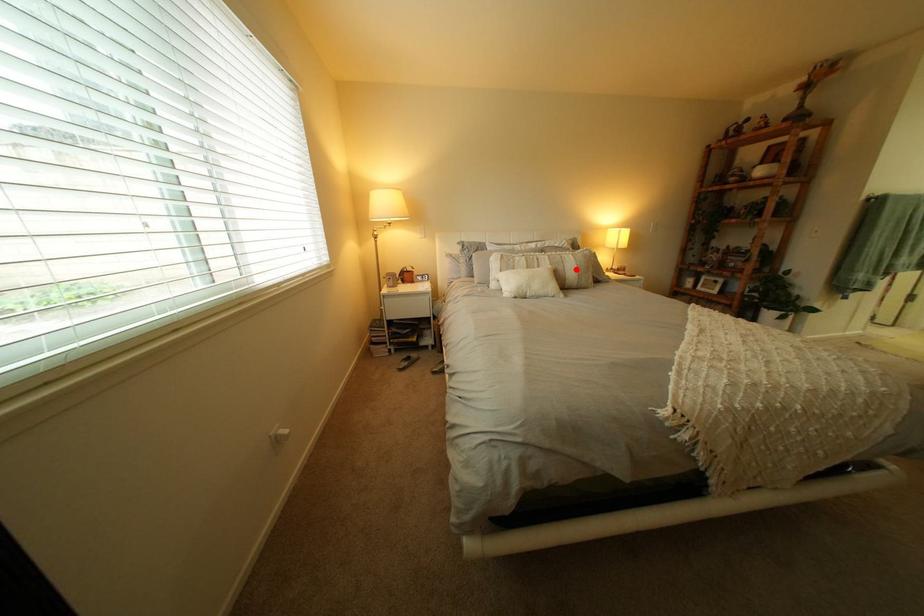
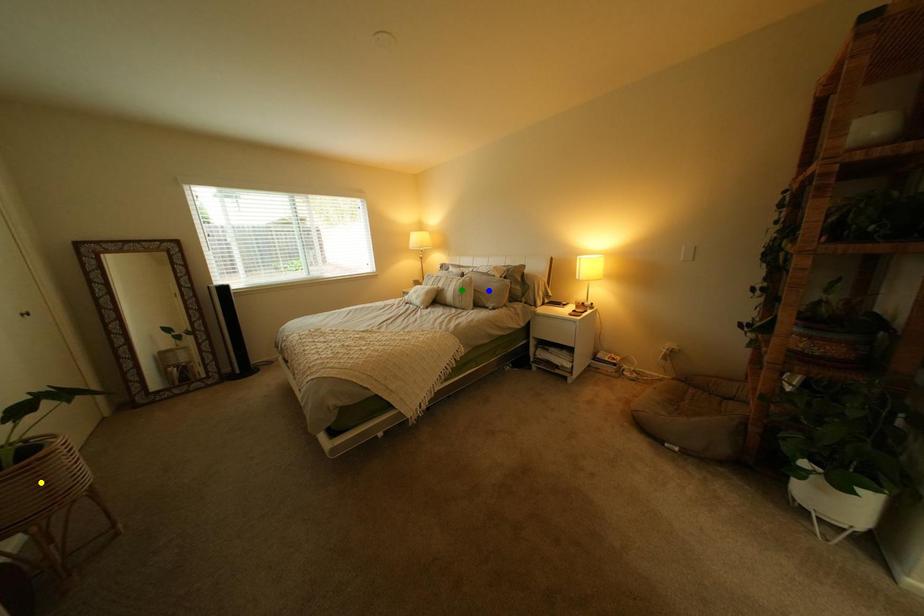
Question: I am providing you with two images of the same scene from different viewpoints. A red point is marked on the first image. You are given multiple points on the second image. Which mark in image 2 goes with the point in image 1?

Choices:
 (A) yellow point
 (B) blue point
 (C) green point

Answer: (C)